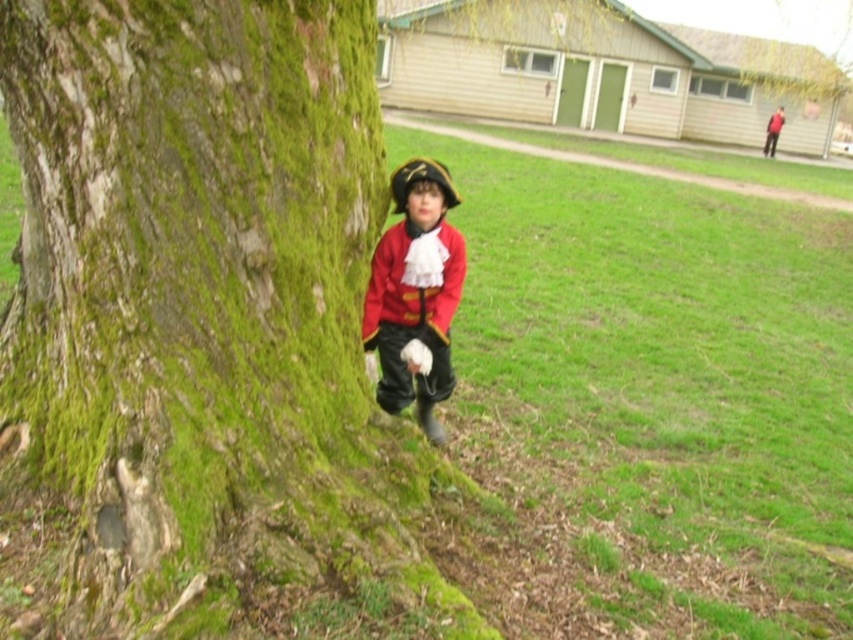
Question: Is matte red coat at center smaller than matte red jacket at center?

Choices:
 (A) yes
 (B) no

Answer: (B)

Question: Is green mossy bark at left to the right of matte red coat at center from the viewer's perspective?

Choices:
 (A) yes
 (B) no

Answer: (B)

Question: Which of the following is the closest to the observer?

Choices:
 (A) (140, 93)
 (B) (419, 321)
 (C) (392, 275)

Answer: (A)

Question: Considering the relative positions of green mossy bark at left and matte red jacket at center in the image provided, where is green mossy bark at left located with respect to matte red jacket at center?

Choices:
 (A) right
 (B) left

Answer: (B)

Question: Which object appears closest to the camera in this image?

Choices:
 (A) matte red coat at center
 (B) green mossy bark at left

Answer: (B)

Question: Which point is farther to the camera?

Choices:
 (A) (445, 328)
 (B) (436, 253)
 (C) (57, 205)

Answer: (A)